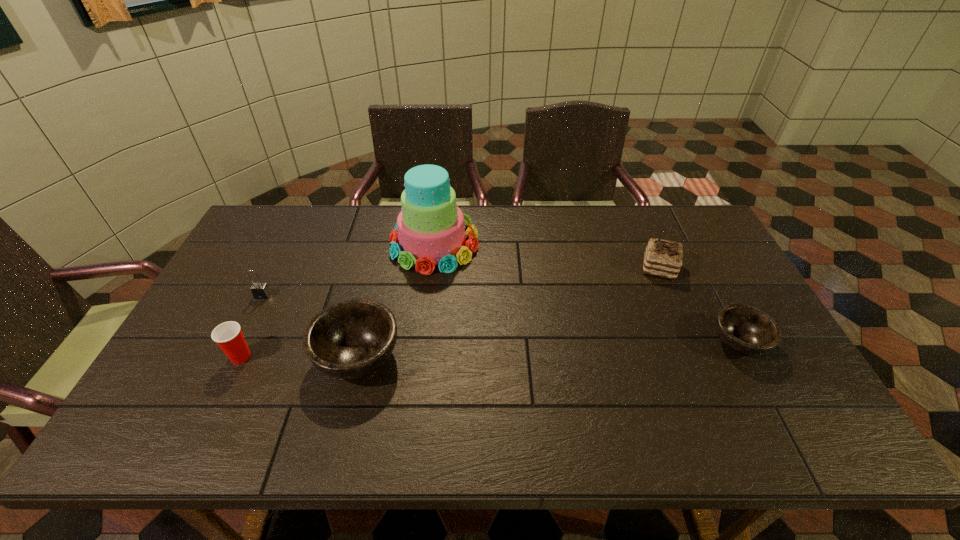
Where is `the left bowl`? The width and height of the screenshot is (960, 540). the left bowl is located at coordinates (351, 338).

This screenshot has width=960, height=540. I want to click on the shortest object, so click(745, 329).

Locate an element on the screen. This screenshot has height=540, width=960. the shorter bowl is located at coordinates (x=745, y=329).

I want to click on the tallest object, so click(430, 230).

Find the location of a particular element. padlock is located at coordinates (260, 290).

You are a GUI agent. You are given a task and a screenshot of the screen. Output one action in this format:
    pyautogui.click(x=<x>, y=<y>)
    Task: Click on the chocolate cake
    The height and width of the screenshot is (540, 960).
    Given the screenshot: What is the action you would take?
    pyautogui.click(x=663, y=258)

Find the location of a particular element. The width and height of the screenshot is (960, 540). Dixie cup is located at coordinates (228, 335).

The width and height of the screenshot is (960, 540). I want to click on free space located on the right of the taller bowl, so click(x=467, y=356).

The width and height of the screenshot is (960, 540). What are the coordinates of `vacant space located on the back of the right bowl` in the screenshot? It's located at (686, 243).

Image resolution: width=960 pixels, height=540 pixels. Find the location of `vacant region located 0.350m on the right of the cake`. vacant region located 0.350m on the right of the cake is located at coordinates pos(584,244).